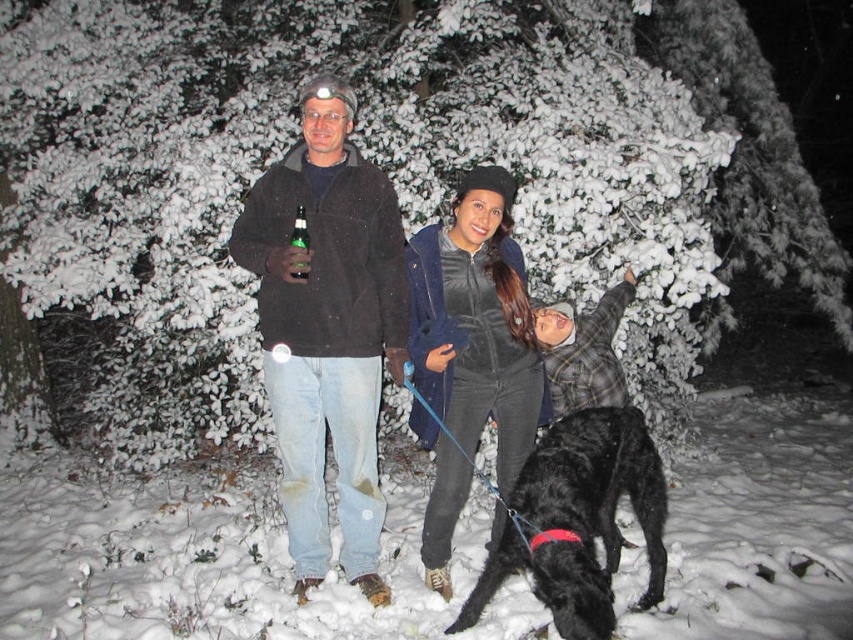
Question: Which point is closer to the camera?

Choices:
 (A) green glass bottle at center
 (B) snow-covered evergreen tree at upper center
 (C) dark gray fleece jacket at center
 (D) shiny black fur at center

Answer: (D)

Question: Is white fluffy snow at lower center closer to camera compared to dark brown jacket at center?

Choices:
 (A) no
 (B) yes

Answer: (A)

Question: Can you confirm if dark brown jacket at center is thinner than shiny black fur at center?

Choices:
 (A) yes
 (B) no

Answer: (A)

Question: Is dark gray fleece jacket at center positioned in front of green glass bottle at center?

Choices:
 (A) no
 (B) yes

Answer: (B)

Question: Which object is the closest to the dark gray fleece jacket at center?

Choices:
 (A) snow-covered evergreen tree at upper center
 (B) green glass bottle at center
 (C) shiny black fur at center
 (D) dark brown jacket at center

Answer: (D)

Question: Which of these objects is positioned farthest from the velvet black jacket at center?

Choices:
 (A) dark brown jacket at center
 (B) snow-covered evergreen tree at upper center

Answer: (B)